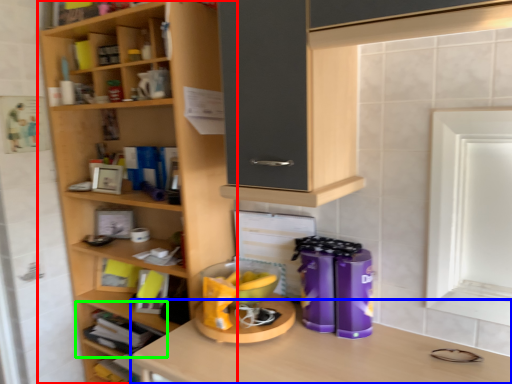
Question: Estimate the real-world distances between objects in this image. Which object is farther from shelf (highlighted by a red box), desk (highlighted by a blue box) or shelf (highlighted by a green box)?

Choices:
 (A) desk
 (B) shelf

Answer: (A)